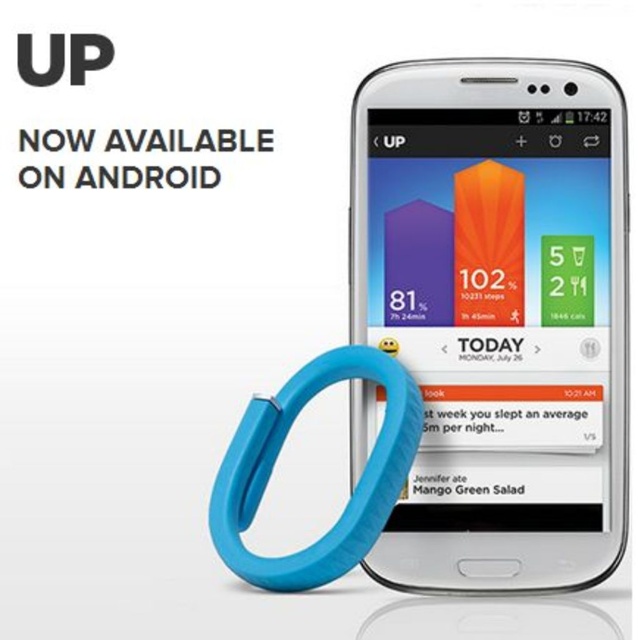
Is point (584, 272) behind point (255, 451)?

Yes.

Is white glossy smartphone at center thinner than blue rubber band at lower left?

No, white glossy smartphone at center is not thinner than blue rubber band at lower left.

Does point (463, 234) come behind point (396, 424)?

Yes, it is behind point (396, 424).

This screenshot has height=640, width=638. I want to click on white glossy smartphone at center, so click(x=498, y=314).